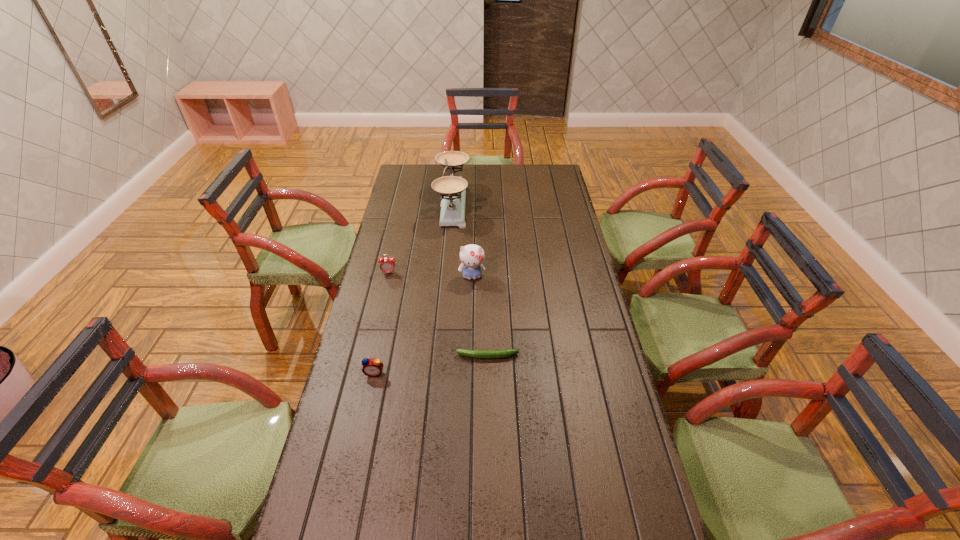
This screenshot has height=540, width=960. I want to click on vacant space located 0.180m on the front-facing side of the nearer alarm clock, so click(x=362, y=432).

Locate an element on the screen. vacant area located 0.180m on the front-facing side of the shortest object is located at coordinates (400, 356).

The height and width of the screenshot is (540, 960). Find the location of `blank space located on the front-facing side of the shortest object`. blank space located on the front-facing side of the shortest object is located at coordinates (385, 356).

Locate an element on the screen. This screenshot has width=960, height=540. vacant space located on the front-facing side of the shortest object is located at coordinates (360, 356).

Where is `object that is at the far edge`? Image resolution: width=960 pixels, height=540 pixels. object that is at the far edge is located at coordinates (452, 189).

Find the location of a particular element. The width and height of the screenshot is (960, 540). vacant space at the far edge is located at coordinates (433, 179).

The height and width of the screenshot is (540, 960). I want to click on free spot at the left edge of the desktop, so click(372, 342).

This screenshot has width=960, height=540. In order to click on vacant space at the right edge of the desktop in this screenshot , I will do `click(577, 407)`.

Where is `vacant space at the far left corner of the desktop`? The width and height of the screenshot is (960, 540). vacant space at the far left corner of the desktop is located at coordinates (403, 184).

Find the location of `free location at the far right corner of the desktop`. free location at the far right corner of the desktop is located at coordinates (554, 173).